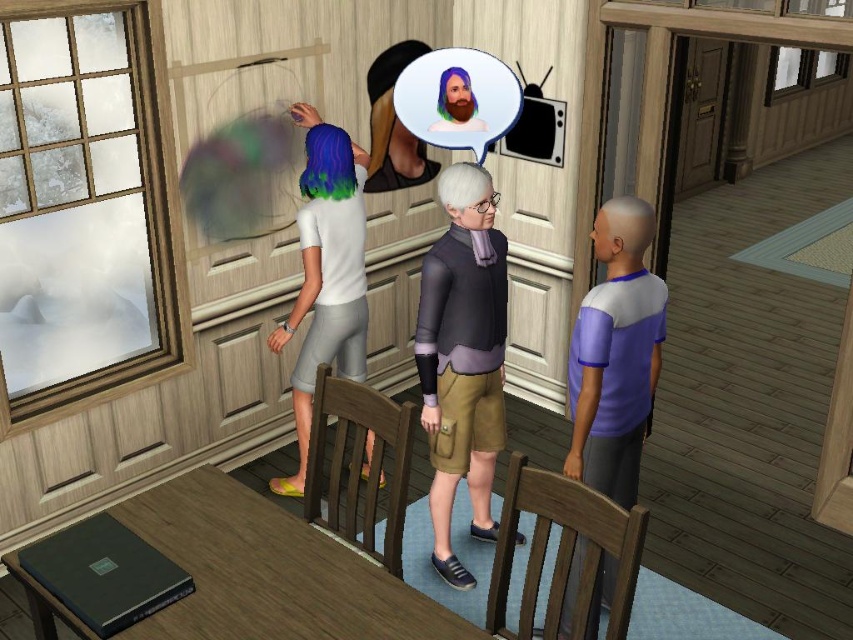
Question: Which point is farther from the camera taking this photo?

Choices:
 (A) (659, 326)
 (B) (299, 388)
 (C) (486, 499)
 (D) (453, 138)

Answer: (B)

Question: Which point is closer to the camera?

Choices:
 (A) (480, 81)
 (B) (447, 429)
 (C) (645, 349)

Answer: (C)

Question: Which point is closer to the camera taking this photo?

Choices:
 (A) (451, 337)
 (B) (511, 115)
 (C) (328, 131)
 (D) (566, 461)

Answer: (D)

Question: Does purple fabric shirt at right lie in front of bearded man at center?

Choices:
 (A) yes
 (B) no

Answer: (A)

Question: Is dark gray sweater at center positioned in front of bearded man at center?

Choices:
 (A) no
 (B) yes

Answer: (B)

Question: In this image, where is purple fabric shirt at right located relative to white matte shirt at center?

Choices:
 (A) above
 (B) below

Answer: (B)